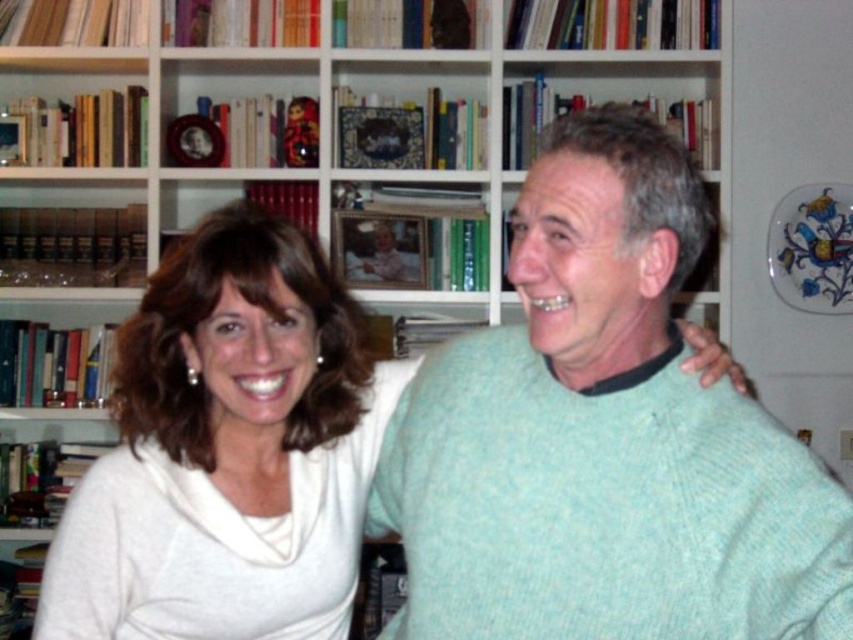
Between light green knitted sweater at center and white soft sweater at left, which one appears on the right side from the viewer's perspective?

Positioned to the right is light green knitted sweater at center.

Who is more forward, (711, 492) or (250, 500)?

Point (711, 492) is more forward.

Which is in front, point (490, 372) or point (306, 291)?

Positioned in front is point (306, 291).

This screenshot has width=853, height=640. Find the location of `light green knitted sweater at center`. light green knitted sweater at center is located at coordinates (602, 436).